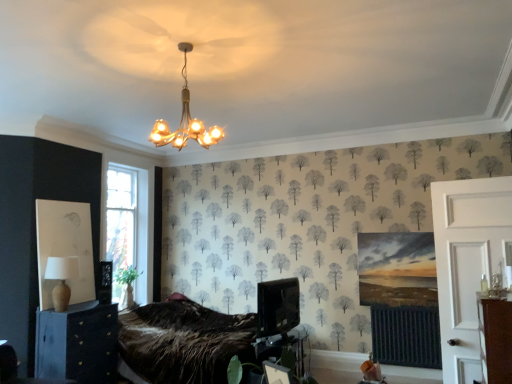
Question: Can you confirm if matte black cabinet at lower left is thinner than white wooden door at right?

Choices:
 (A) yes
 (B) no

Answer: (B)

Question: Is matte black cabinet at lower left in contact with white wooden door at right?

Choices:
 (A) no
 (B) yes

Answer: (A)

Question: Is matte black cabinet at lower left far from white wooden door at right?

Choices:
 (A) no
 (B) yes

Answer: (B)

Question: Is matte black cabinet at lower left taller than white wooden door at right?

Choices:
 (A) no
 (B) yes

Answer: (A)

Question: Does matte black cabinet at lower left have a smaller size compared to white wooden door at right?

Choices:
 (A) yes
 (B) no

Answer: (B)

Question: Looking at the image, does gold metallic chandelier at upper center seem bigger or smaller compared to metallic silver table at lower center?

Choices:
 (A) small
 (B) big

Answer: (A)

Question: From a real-world perspective, is gold metallic chandelier at upper center above or below metallic silver table at lower center?

Choices:
 (A) below
 (B) above

Answer: (B)

Question: Would you say gold metallic chandelier at upper center is inside or outside metallic silver table at lower center?

Choices:
 (A) inside
 (B) outside

Answer: (B)

Question: Does point (163, 124) appear closer or farther from the camera than point (292, 370)?

Choices:
 (A) closer
 (B) farther

Answer: (A)

Question: Is matte black cabinet at lower left bigger or smaller than beige fabric lampshade at lower left?

Choices:
 (A) big
 (B) small

Answer: (A)

Question: In the image, is matte black cabinet at lower left on the left side or the right side of beige fabric lampshade at lower left?

Choices:
 (A) left
 (B) right

Answer: (B)

Question: In the image, is matte black cabinet at lower left positioned in front of or behind beige fabric lampshade at lower left?

Choices:
 (A) front
 (B) behind

Answer: (A)

Question: From the image's perspective, relative to beige fabric lampshade at lower left, is matte black cabinet at lower left above or below?

Choices:
 (A) below
 (B) above

Answer: (A)

Question: Is metallic silver table at lower center to the left or to the right of matte black cabinet at lower left in the image?

Choices:
 (A) left
 (B) right

Answer: (B)

Question: Is metallic silver table at lower center inside the boundaries of matte black cabinet at lower left, or outside?

Choices:
 (A) inside
 (B) outside

Answer: (B)